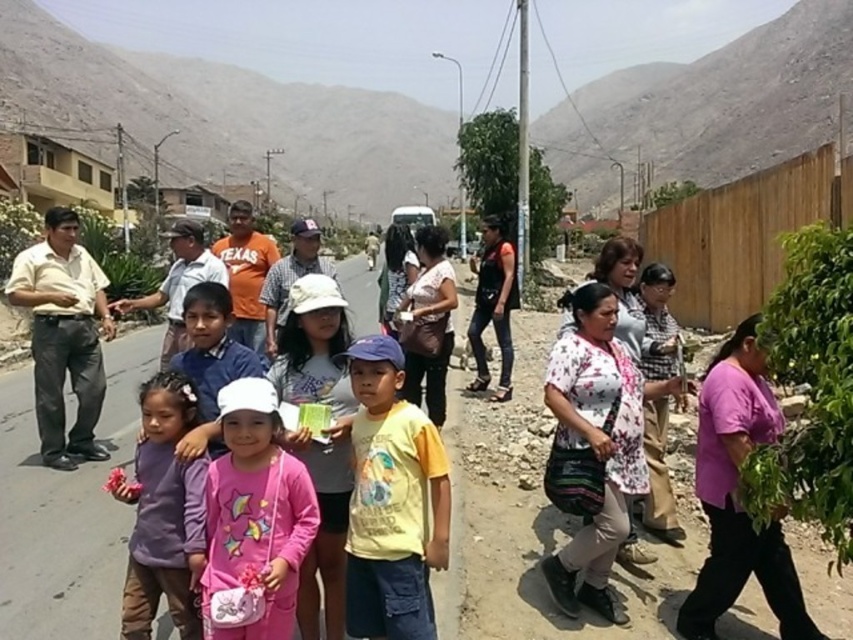
Question: Does yellow cotton shirt at center have a larger size compared to purple fleece jacket at lower left?

Choices:
 (A) no
 (B) yes

Answer: (B)

Question: Does yellow cotton shirt at center appear on the right side of purple fleece jacket at lower left?

Choices:
 (A) no
 (B) yes

Answer: (B)

Question: Estimate the real-world distances between objects in this image. Which object is farther from the yellow cotton shirt at center?

Choices:
 (A) pink fabric purse at center
 (B) purple fleece jacket at lower left

Answer: (B)

Question: Considering the real-world distances, which object is closest to the yellow cotton shirt at center?

Choices:
 (A) purple fleece jacket at lower left
 (B) pink fabric purse at center

Answer: (B)

Question: Estimate the real-world distances between objects in this image. Which object is farther from the purple fleece jacket at lower left?

Choices:
 (A) yellow cotton shirt at center
 (B) pink fabric purse at center

Answer: (A)

Question: Does yellow cotton shirt at center have a lesser width compared to purple fleece jacket at lower left?

Choices:
 (A) no
 (B) yes

Answer: (A)